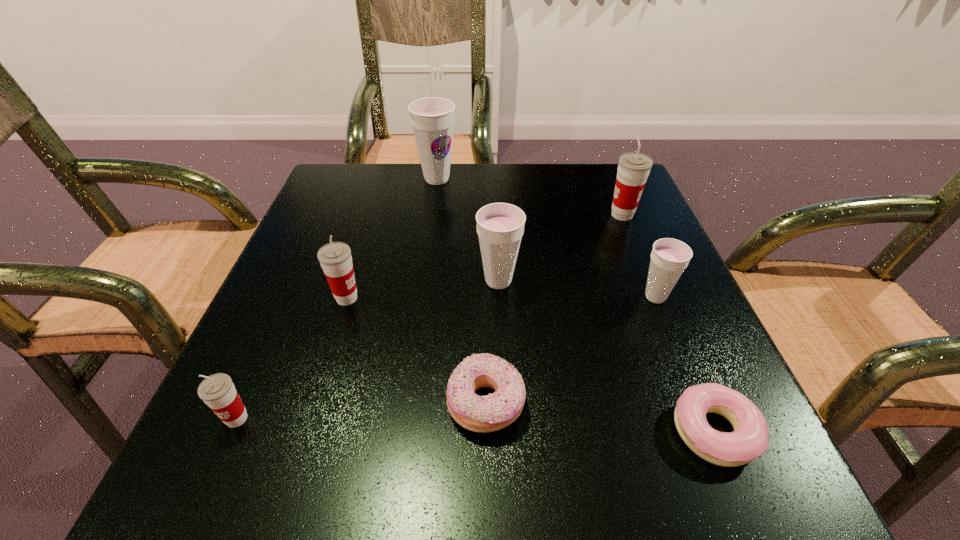
At what (x,y) coordinates should I click in order to perform the action: click on vacant space that satisfies the following two spatial constraints: 1. on the front side of the shortest object; 2. on the right side of the smallest purple cup. Please return your answer as a coordinate pair (x, y). Looking at the image, I should click on (710, 431).